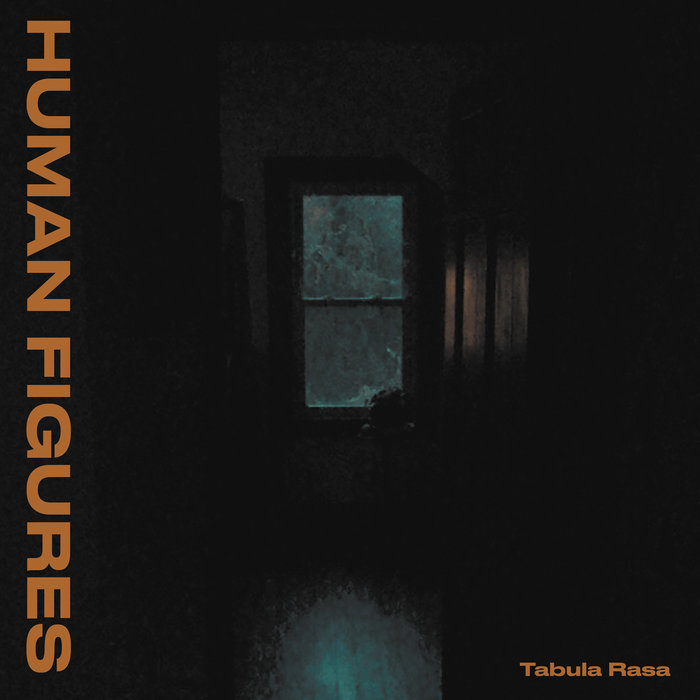
Locate an element on the screen. plant is located at coordinates (396, 409).